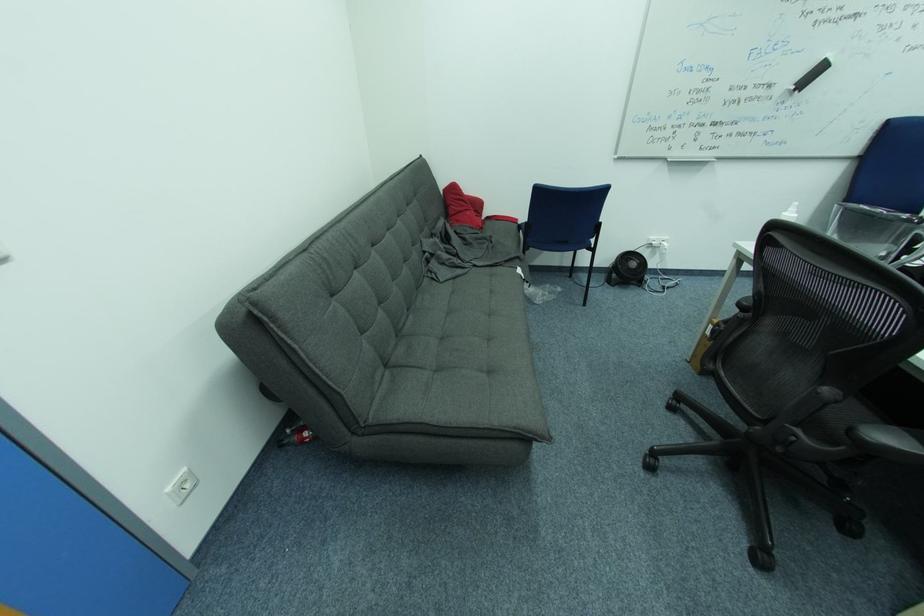
What do you see at coordinates (470, 331) in the screenshot?
I see `the grey sofa sitting surface` at bounding box center [470, 331].